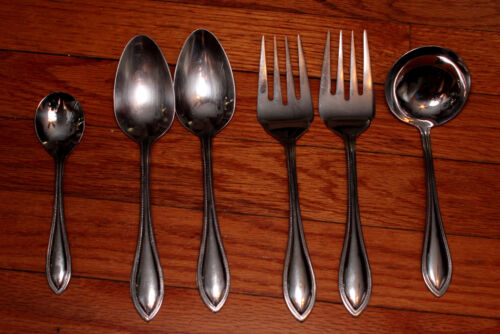
This screenshot has width=500, height=334. In order to click on spoons in this screenshot , I will do `click(70, 127)`, `click(146, 99)`, `click(209, 85)`.